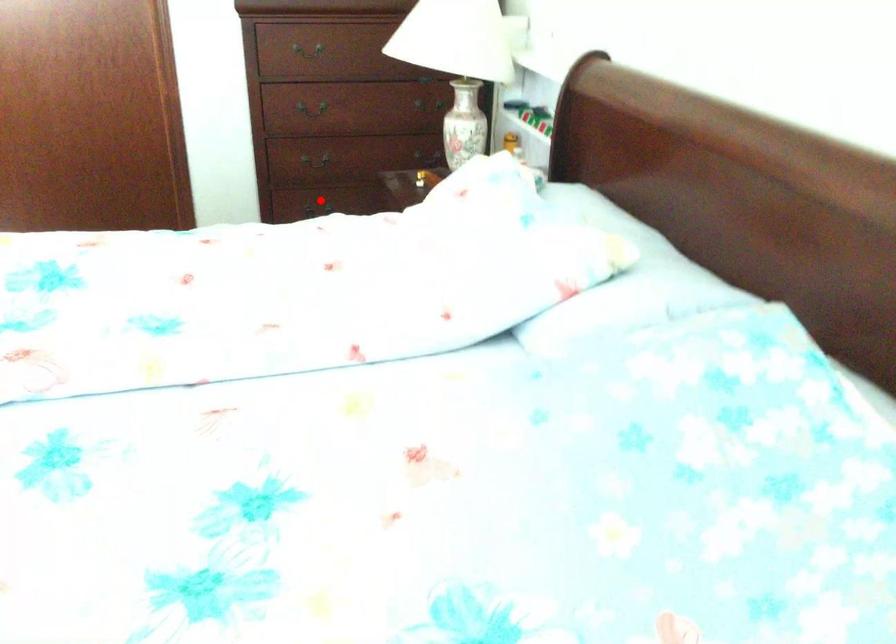
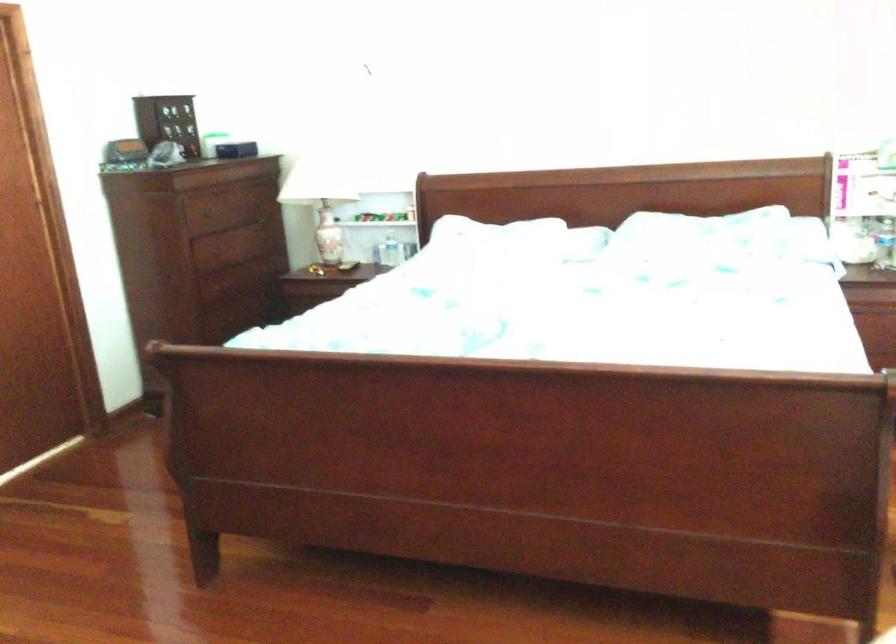
Question: I am providing you with two images of the same scene from different viewpoints. A red point is marked on the first image. At the location where the point appears in image 1, is it still visible in image 2?

Choices:
 (A) Yes
 (B) No

Answer: (B)